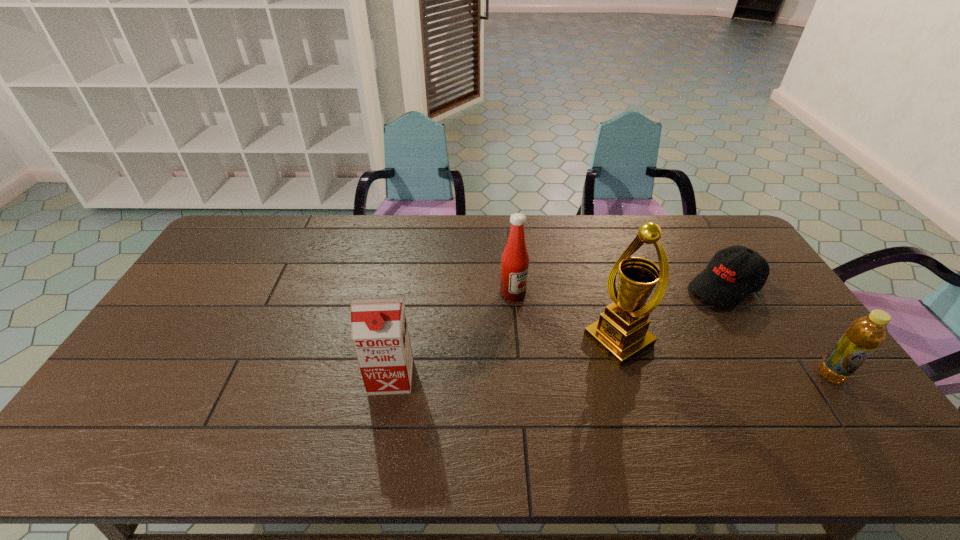
Identify the location of the leftmost object. (379, 330).

The height and width of the screenshot is (540, 960). I want to click on bottle, so click(865, 334).

I want to click on the second object from left to right, so click(x=515, y=260).

The image size is (960, 540). In order to click on baseball cap in this screenshot , I will do `click(733, 273)`.

The width and height of the screenshot is (960, 540). I want to click on the tallest object, so click(x=621, y=333).

Locate an element on the screen. The height and width of the screenshot is (540, 960). the third object from left to right is located at coordinates (621, 333).

At what (x,y) coordinates should I click in order to perform the action: click on free space located 0.270m on the right of the soya milk. Please return your answer as a coordinate pair (x, y). Looking at the image, I should click on (514, 377).

The height and width of the screenshot is (540, 960). I want to click on blank space located 0.070m on the front of the bottle, so click(855, 410).

You are a GUI agent. You are given a task and a screenshot of the screen. Output one action in this format:
    pyautogui.click(x=<x>, y=<y>)
    Task: Click on the vacant position located 0.120m on the front-facing side of the condiment
    
    Given the screenshot: What is the action you would take?
    pyautogui.click(x=545, y=325)

Image resolution: width=960 pixels, height=540 pixels. In order to click on vacant space located 0.300m on the front-facing side of the condiment in this screenshot , I will do `click(588, 367)`.